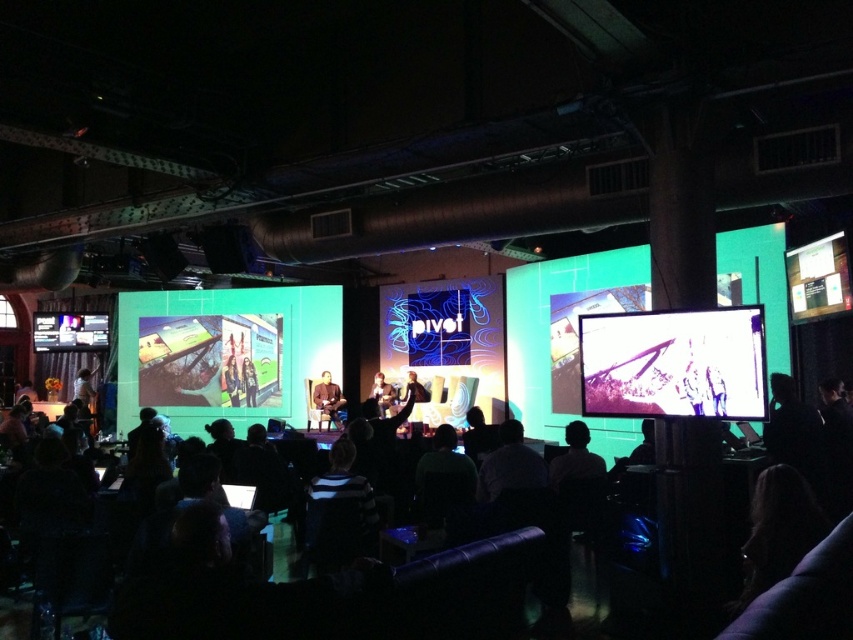
Is point (196, 289) behind point (387, 404)?

Yes, point (196, 289) is farther from viewer.

Can you confirm if matte green screen at left is bigger than smooth skin person at center?

Correct, matte green screen at left is larger in size than smooth skin person at center.

Measure the distance between point (218,289) and camera.

Point (218,289) and camera are 13.22 meters apart.

This screenshot has height=640, width=853. What are the coordinates of `matte green screen at left` in the screenshot? It's located at coord(225,353).

Does metallic silver laptop at center have a larger size compared to smooth leather jacket at center?

Yes.

Does metallic silver laptop at center have a greater height compared to smooth leather jacket at center?

No, metallic silver laptop at center is not taller than smooth leather jacket at center.

The width and height of the screenshot is (853, 640). I want to click on metallic silver laptop at center, so click(x=674, y=364).

Does dark clothing crowd at lower left have a lesser height compared to matte green screen at left?

Yes, dark clothing crowd at lower left is shorter than matte green screen at left.

Is dark clothing crowd at lower left further to camera compared to matte green screen at left?

No, it is not.

Where is `dark clothing crowd at lower left`? Image resolution: width=853 pixels, height=640 pixels. dark clothing crowd at lower left is located at coordinates (329, 596).

You are a GUI agent. You are given a task and a screenshot of the screen. Output one action in this format:
    pyautogui.click(x=<x>, y=<y>)
    Task: Click on the dark clothing crowd at lower left
    Image resolution: width=853 pixels, height=640 pixels.
    Given the screenshot: What is the action you would take?
    pyautogui.click(x=329, y=596)